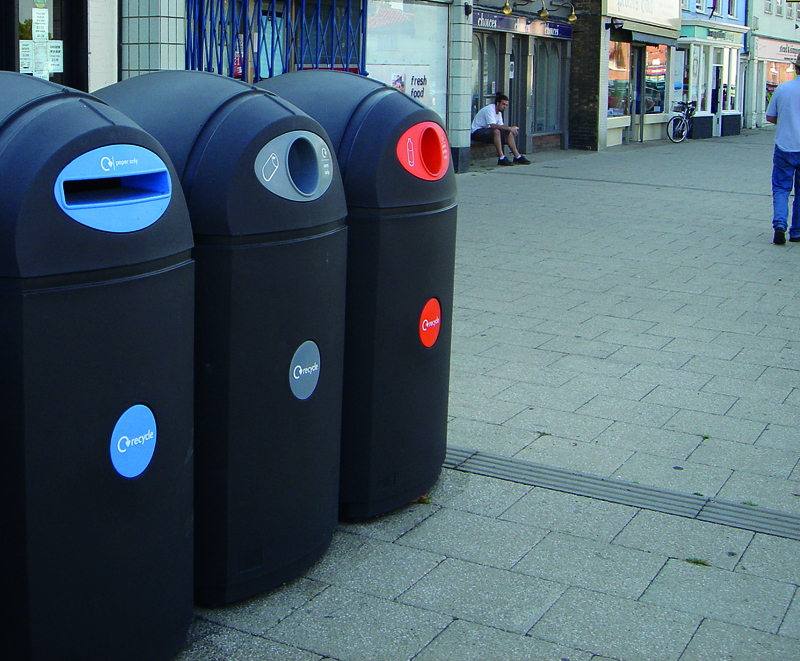
I want to click on light, so click(x=572, y=19).